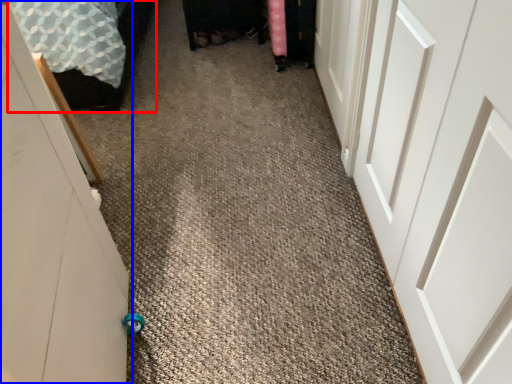
Question: Which object appears closest to the camera in this image, bed (highlighted by a red box) or door (highlighted by a blue box)?

Choices:
 (A) bed
 (B) door

Answer: (B)